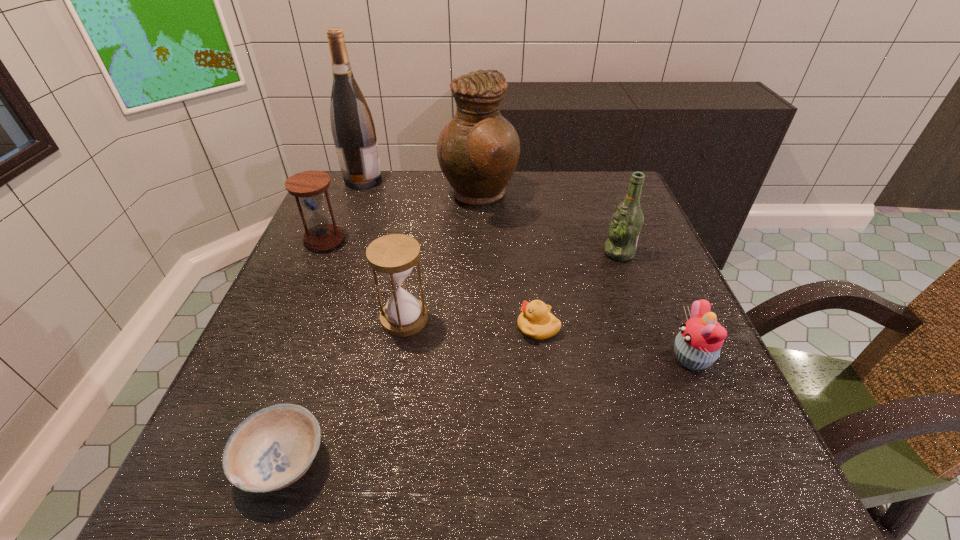
This screenshot has height=540, width=960. I want to click on vacant space in between the beer bottle and the seventh tallest object, so click(579, 290).

Identify the location of free spot between the seventh shortest object and the right hourglass. (442, 258).

Where is `free point between the wine bottle and the left hourglass`? This screenshot has height=540, width=960. free point between the wine bottle and the left hourglass is located at coordinates (344, 210).

Locate an element on the screen. This screenshot has height=540, width=960. vacant region between the second shortest object and the wine bottle is located at coordinates (450, 254).

You are a GUI agent. You are given a task and a screenshot of the screen. Output one action in this format:
    pyautogui.click(x=<x>, y=<y>)
    Task: Click on the vacant space that is in between the nearest object and the beer bottle
    
    Given the screenshot: What is the action you would take?
    pyautogui.click(x=451, y=357)

Where is `unoccupied area between the nearer hourglass and the beer bottle`? unoccupied area between the nearer hourglass and the beer bottle is located at coordinates (512, 286).

This screenshot has height=540, width=960. Identify the location of free space between the farther hourglass and the tallest object. (344, 210).

Locate which object is the second closest to the pitcher. Please provide its 2D coordinates. Your answer should be formatted as a tuple, i.e. [(x, y)], where the tuple contains the x and y coordinates of a point satisfying the conditions above.

[(625, 226)]

Where is `the closest object relative to the farther hourglass`? This screenshot has height=540, width=960. the closest object relative to the farther hourglass is located at coordinates (352, 126).

Locate an element on the screen. Image resolution: width=960 pixels, height=540 pixels. vacant space that satisfies the following two spatial constraints: 1. on the label of the wine bottle; 2. on the left side of the right hourglass is located at coordinates (310, 319).